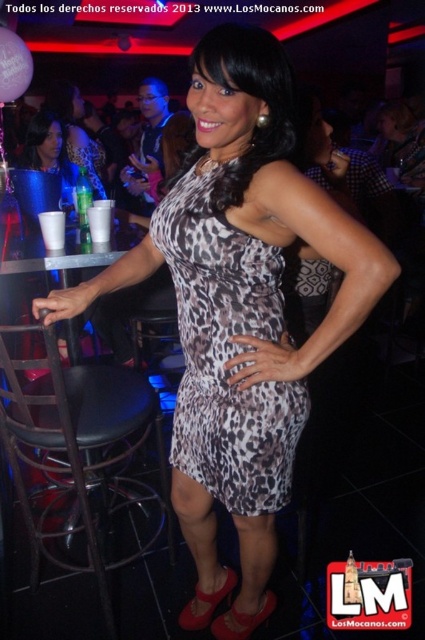
You are a photographer at the nightclub and want to capture both the leopard print dress at center and the matte black dress at upper left in the same frame. Which dress is closer to the camera?

The leopard print dress at center is positioned under the matte black dress at upper left, meaning it is closer to the camera.

You are a fashion designer observing the nightclub scene. You need to determine which outfit is shorter between the leopard print dress at center and the matte black dress at upper left. Which one should you recommend if you want to design a shorter dress?

The leopard print dress at center is not as tall as matte black dress at upper left, so the leopard print dress at center is shorter. Therefore, you should recommend the leopard print dress at center if you want to design a shorter dress.